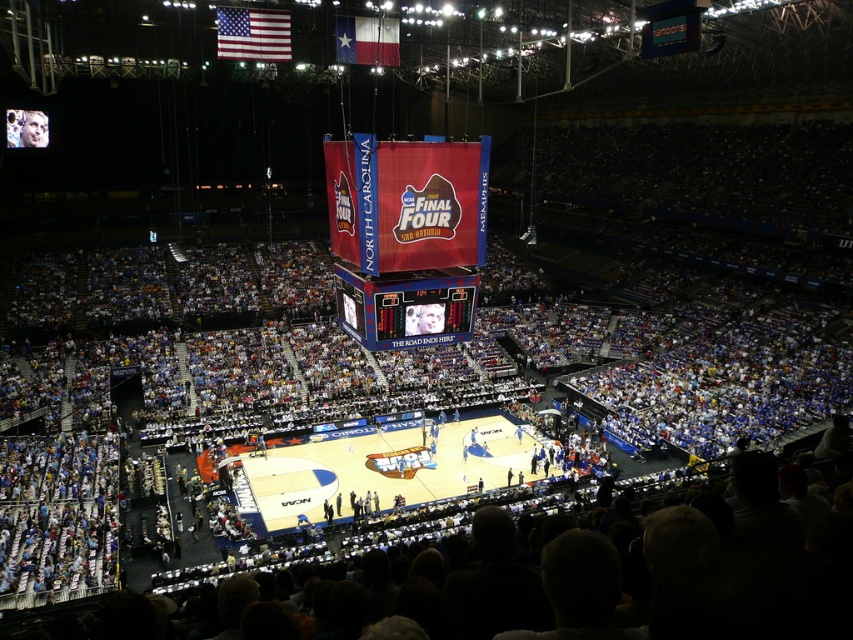
Question: Which point is farther from the camera taking this photo?

Choices:
 (A) (403, 323)
 (B) (403, 330)
 (C) (288, 44)
 (D) (386, 60)

Answer: (D)

Question: Does white glossy basketball court at center appear on the right side of american flag at upper left?

Choices:
 (A) yes
 (B) no

Answer: (A)

Question: Can you confirm if white glossy basketball court at center is positioned above matte black scoreboard at center?

Choices:
 (A) yes
 (B) no

Answer: (B)

Question: Is matte plastic scoreboard at center to the left of american flag at upper left from the viewer's perspective?

Choices:
 (A) no
 (B) yes

Answer: (A)

Question: Which point appears closest to the camera in this image?

Choices:
 (A) (428, 337)
 (B) (361, 60)
 (C) (285, 42)

Answer: (A)

Question: Which point is closer to the camera?

Choices:
 (A) (347, 28)
 (B) (389, 346)

Answer: (B)